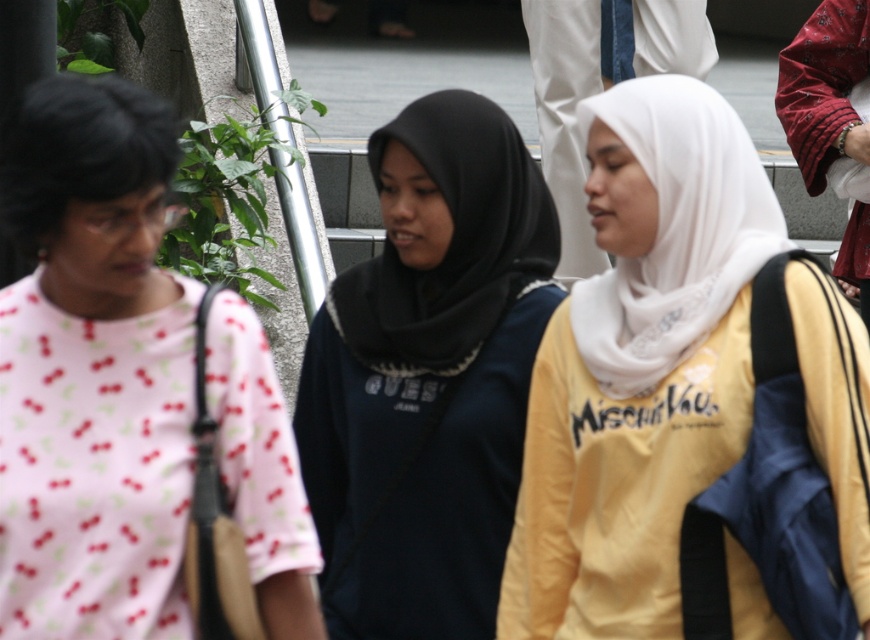
In the scene shown: Based on the scene description, where is the white matte hijab at center located in the image?

The white matte hijab at center is located at the 2D coordinates point (x=640, y=365).

From the picture: You are standing in an urban area and see two points in the image. Which point is closer to you, point (668, 429) or point (104, 129)?

Point (104, 129) is closer to you than point (668, 429).